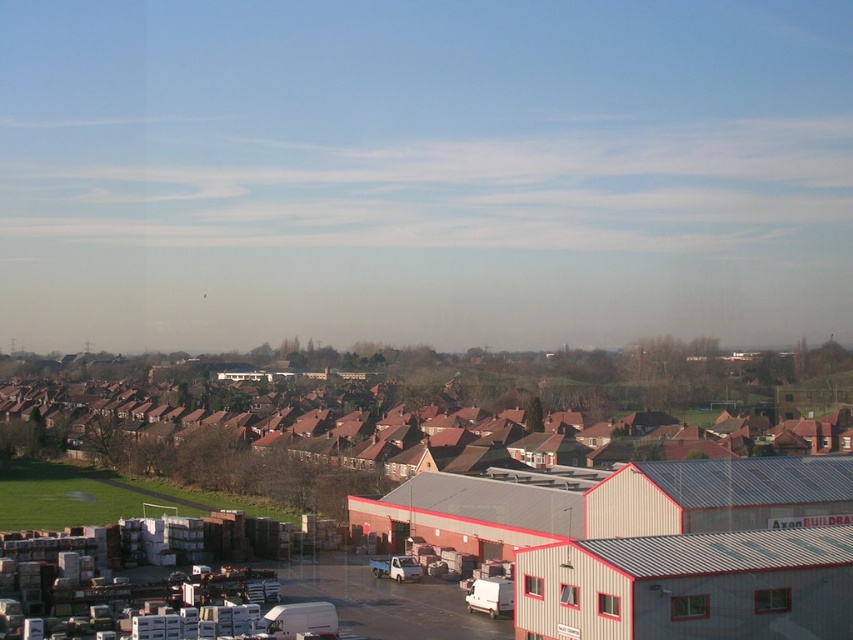
Based on the photo, you are a delivery driver who needs to park your truck near the white corrugated metal warehouse at center and the brown tiled roofs at center. Based on their heights, which structure should you park closer to if you want to avoid blocking the sunlight for the taller one?

The white corrugated metal warehouse at center is not as tall as brown tiled roofs at center. Therefore, you should park closer to the white corrugated metal warehouse at center to avoid blocking sunlight for the taller brown tiled roofs at center.

You are a delivery driver who needs to park your white matte truck at center in a spot that can accommodate its size. There is a parking area near the brown tiled roofs at center. Can you safely park your truck there?

The brown tiled roofs at center is larger in size than the white matte truck at center, so the parking area near the brown tiled roofs at center is likely large enough to accommodate the white matte truck at center safely.